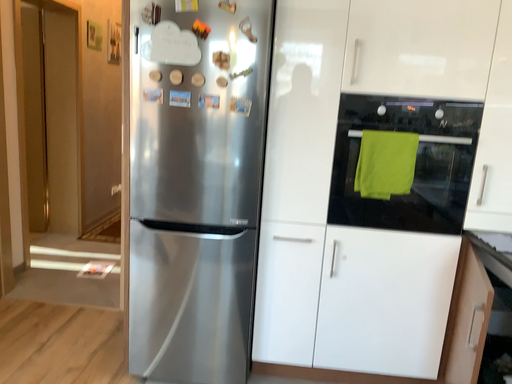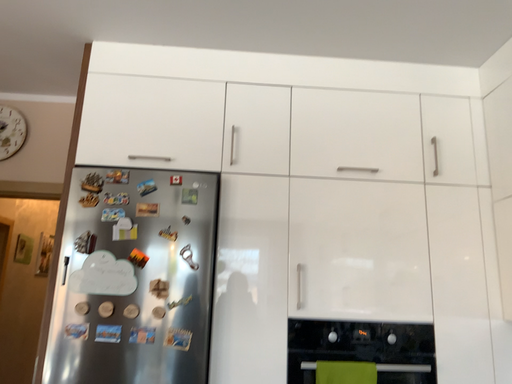
Question: How did the camera likely rotate when shooting the video?

Choices:
 (A) rotated left
 (B) rotated right

Answer: (B)